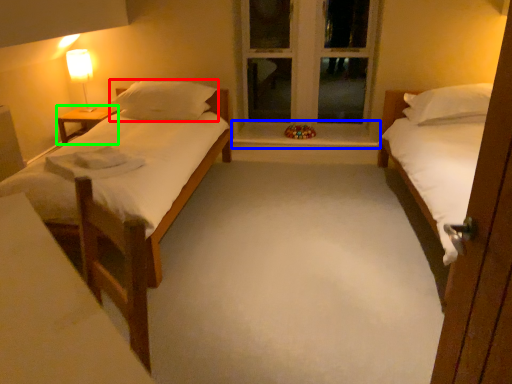
Question: Which object is the farthest from pillow (highlighted by a red box)? Choose among these: window sill (highlighted by a blue box) or nightstand (highlighted by a green box).

Choices:
 (A) window sill
 (B) nightstand

Answer: (A)